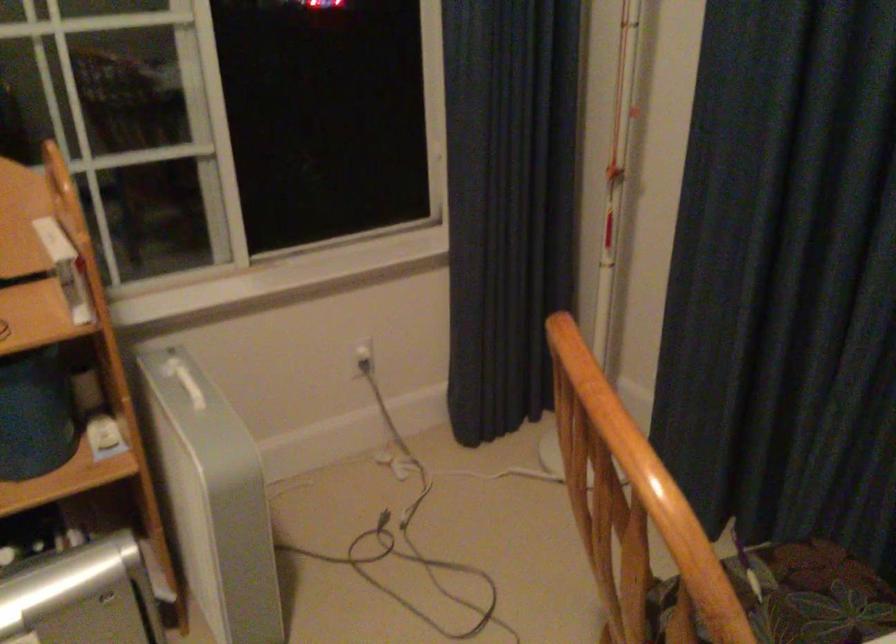
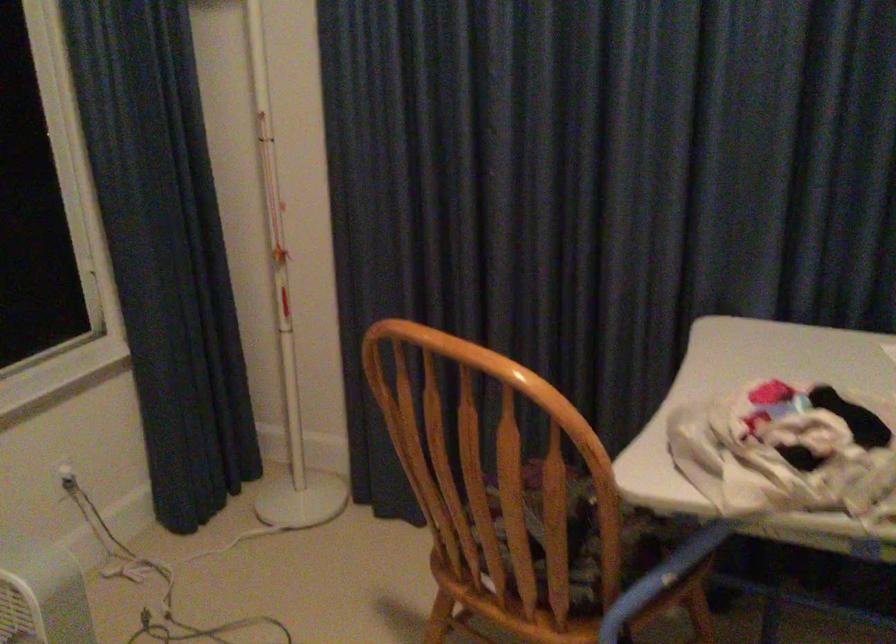
Locate, in the second image, the point that corresponds to (416,489) in the first image.

(164, 581)